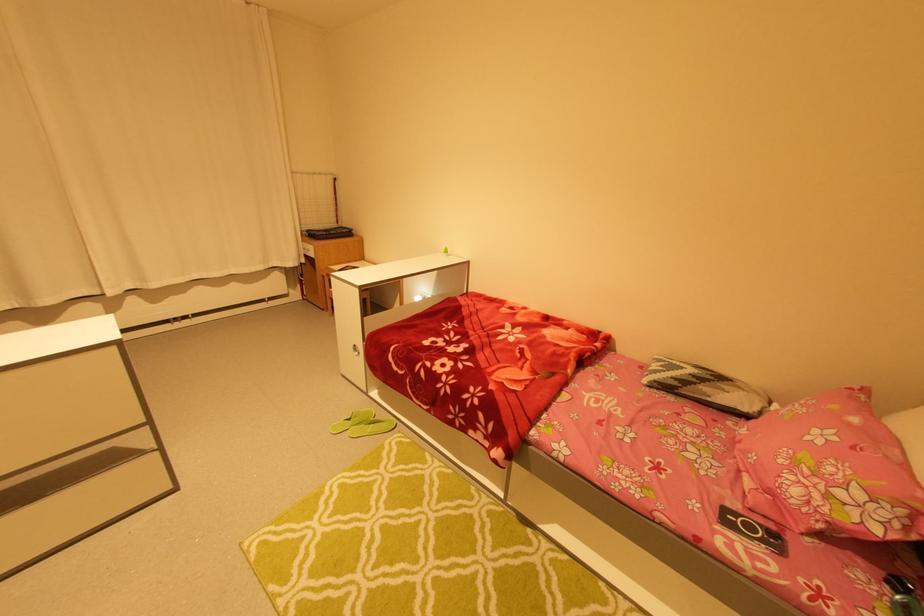
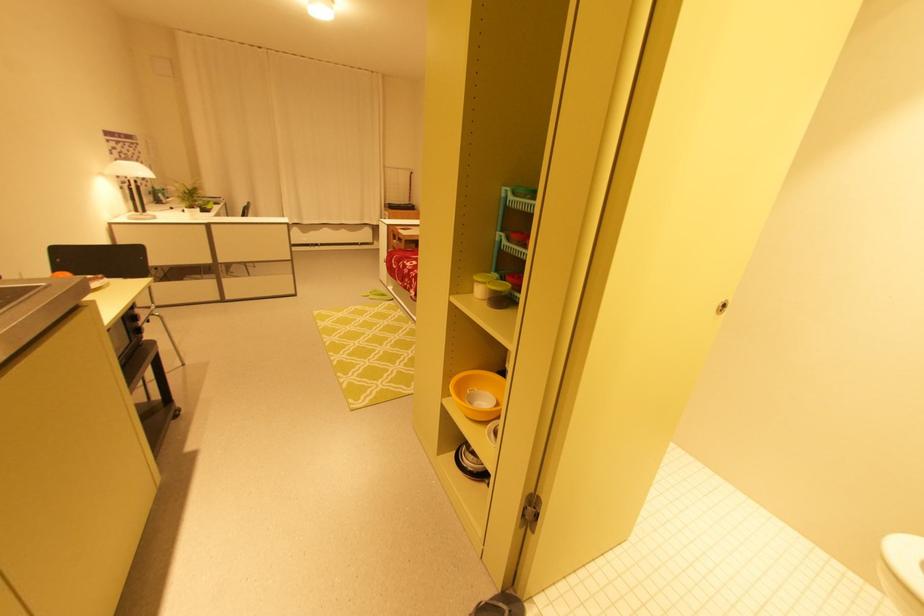
What movement of the cameraman would produce the second image?

The cameraman moved toward right, backward.